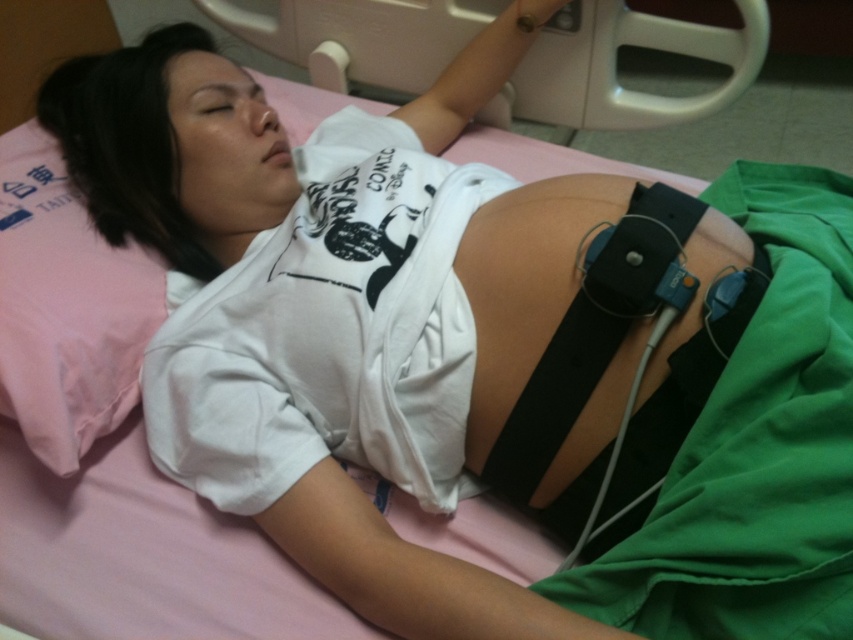
You are a nurse in a hospital room. You need to check the sensors on the black rubber belt at upper center and the pink fabric pillow at left. Which object is located to the right side of the other?

The black rubber belt at upper center is to the right of the pink fabric pillow at left.

You are a nurse in a hospital room. You need to check the sensors on the black rubber belt at upper center and the text on the pink fabric pillow at left. Which object should you check first if you want to start with the one closer to the head of the patient?

The black rubber belt at upper center is located above the pink fabric pillow at left, so it is closer to the head of the patient. Therefore, you should check the sensors on the black rubber belt at upper center first.